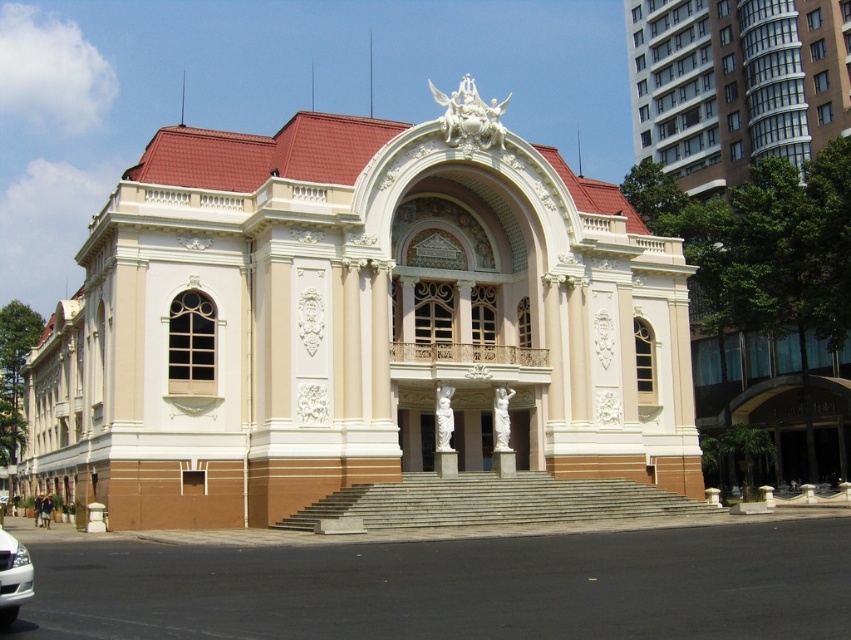
You are standing at the entrance of the beige stone palace at center. If you walk straight ahead, which direction will you be facing relative to the palace?

Since the beige stone palace at center is positioned at point [357,323], walking straight ahead from the entrance would lead you away from the palace towards the opposite direction.

You are standing in front of a beige stone palace at center. If you want to take a photo of it from where you are standing, will you be able to capture the entire building in one shot without zooming in? Explain your reasoning based on the distance provided.

The beige stone palace at center is 47.21 meters away from the camera. Depending on the camera lens and sensor size, capturing the entire building at this distance may be possible with a wide enough angle. However, standard smartphone cameras might require stepping back or using a wide lens to ensure the entire structure fits within the frame.

From the picture: You are a photographer standing in front of the beige stone palace at center and the white glossy car at lower left. You want to capture a photo that includes both objects in the frame. Which object should you position closer to the bottom of the photo?

The beige stone palace at center is above the white glossy car at lower left, so to include both in the frame, position the white glossy car at lower left closer to the bottom of the photo.